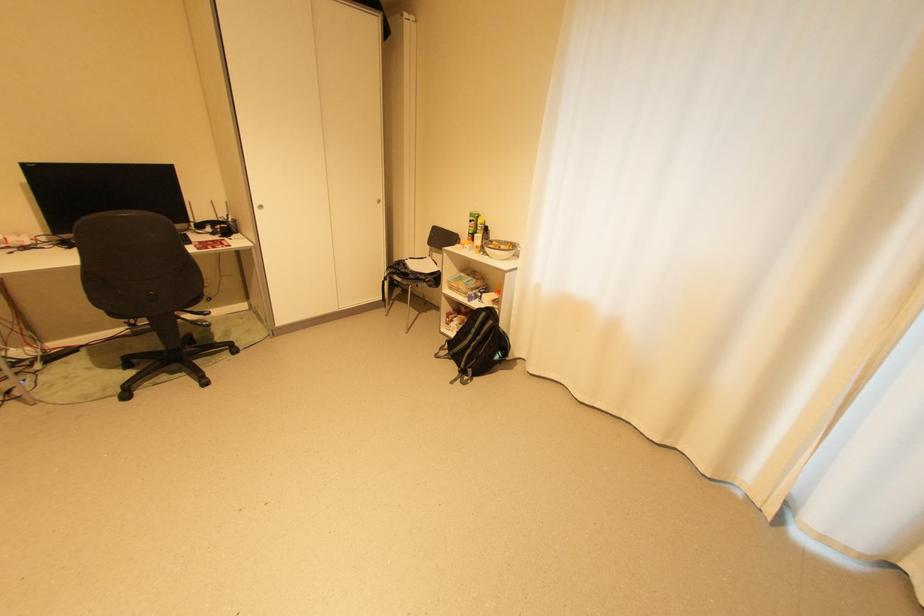
Find where to lift the white bowl. Please return your answer as a coordinate pair (x, y).

(500, 249)